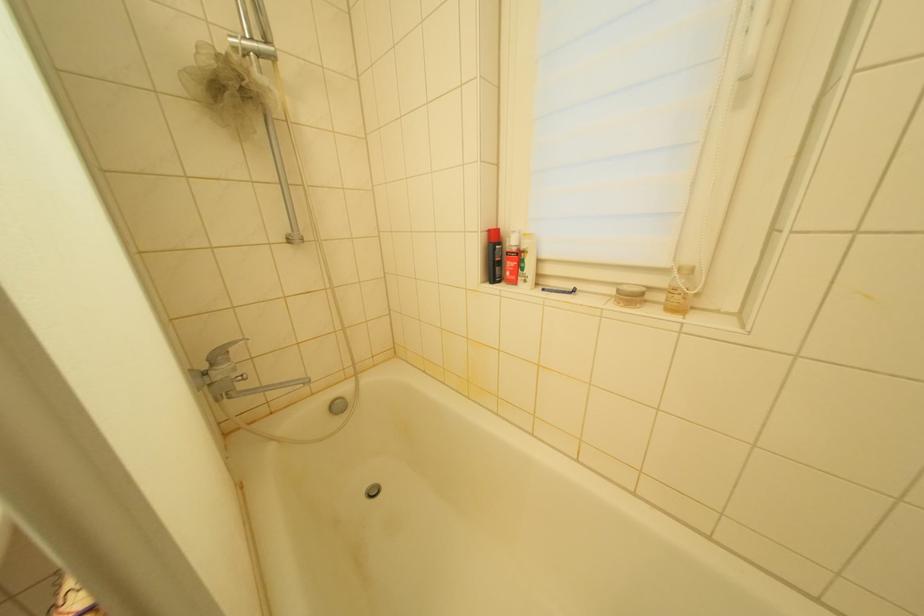
The image size is (924, 616). Describe the element at coordinates (222, 352) in the screenshot. I see `the faucet handle` at that location.